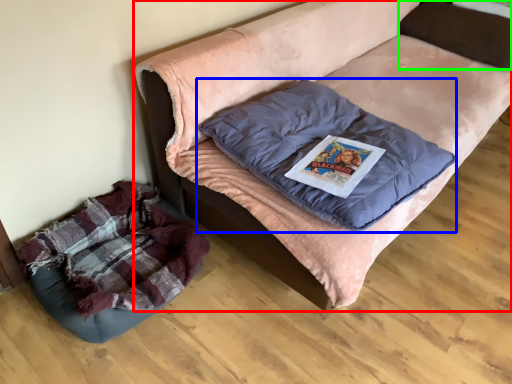
Question: Which object is positioned farthest from furniture (highlighted by a red box)? Select from pillow (highlighted by a blue box) and pillow (highlighted by a green box).

Choices:
 (A) pillow
 (B) pillow

Answer: (B)